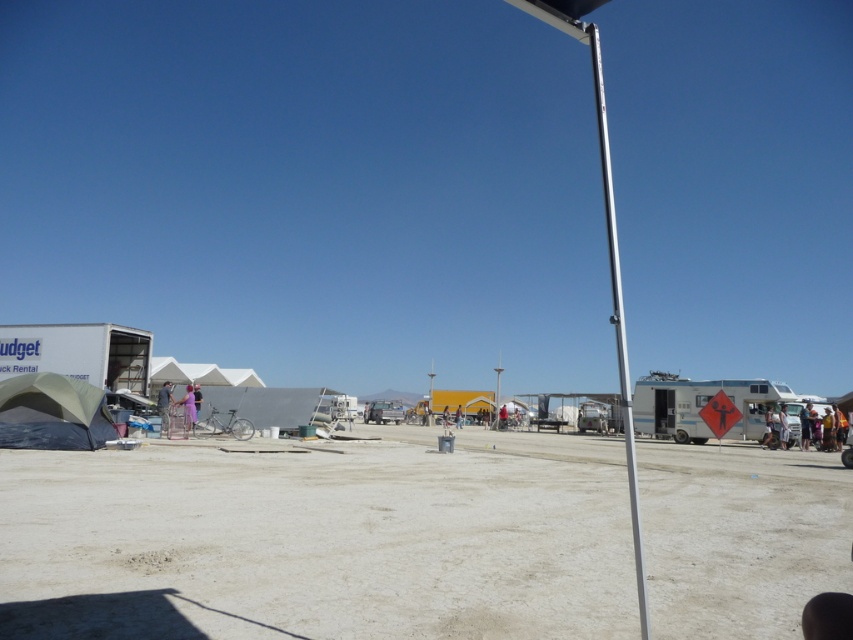
From the picture: Can you confirm if dirt field at center is positioned to the left of matte gray tent at lower left?

Incorrect, dirt field at center is not on the left side of matte gray tent at lower left.

Can you confirm if dirt field at center is thinner than matte gray tent at lower left?

Incorrect, dirt field at center's width is not less than matte gray tent at lower left's.

Is point (193, 570) closer to viewer compared to point (26, 416)?

Yes, point (193, 570) is in front of point (26, 416).

This screenshot has height=640, width=853. I want to click on dirt field at center, so click(x=320, y=540).

Who is positioned more to the left, matte gray tent at lower left or white matte camper at right?

matte gray tent at lower left is more to the left.

Who is more distant from viewer, (1,442) or (680,384)?

The point (680,384) is more distant.

What do you see at coordinates (51, 413) in the screenshot? I see `matte gray tent at lower left` at bounding box center [51, 413].

Identify the location of matte gray tent at lower left. (51, 413).

In the scene shown: Does yellow fabric tent at lower right have a lesser height compared to purple fabric dress at center?

No.

Is point (809, 435) more distant than point (184, 408)?

Yes, it is behind point (184, 408).

What do you see at coordinates (796, 420) in the screenshot?
I see `yellow fabric tent at lower right` at bounding box center [796, 420].

Find the location of `yellow fabric tent at lower right`. yellow fabric tent at lower right is located at coordinates (796, 420).